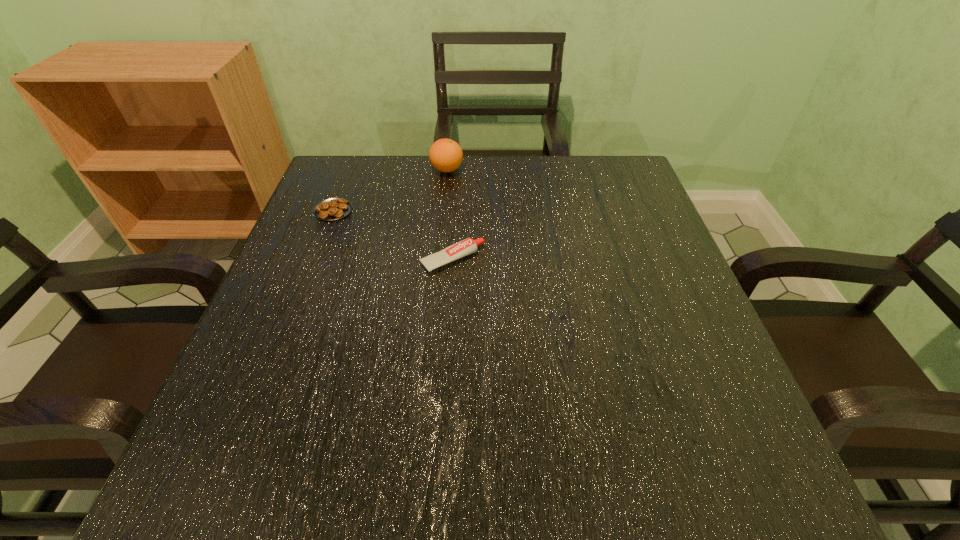
This screenshot has height=540, width=960. In order to click on free space between the second farthest object and the nearest object in this screenshot , I will do `click(393, 235)`.

Locate an element on the screen. The width and height of the screenshot is (960, 540). empty space between the shortest object and the toothpaste is located at coordinates (393, 235).

You are a GUI agent. You are given a task and a screenshot of the screen. Output one action in this format:
    pyautogui.click(x=<x>, y=<y>)
    Task: Click on the vacant space in between the tallest object and the second farthest object
    The width and height of the screenshot is (960, 540).
    Given the screenshot: What is the action you would take?
    pyautogui.click(x=391, y=190)

This screenshot has height=540, width=960. I want to click on vacant area that lies between the toothpaste and the orange, so click(449, 215).

Locate an element on the screen. free space between the pastry and the farthest object is located at coordinates pos(391,190).

The width and height of the screenshot is (960, 540). Find the location of `vacant region between the toothpaste and the orange`. vacant region between the toothpaste and the orange is located at coordinates (449, 215).

This screenshot has height=540, width=960. In order to click on vacant area that lies between the farthest object and the second farthest object in this screenshot , I will do `click(391, 190)`.

The image size is (960, 540). I want to click on vacant space that is in between the pastry and the farthest object, so click(391, 190).

Where is `vacant space in between the tallest object and the shortest object`? The image size is (960, 540). vacant space in between the tallest object and the shortest object is located at coordinates (391, 190).

Where is `empty space between the nearest object and the pastry`? empty space between the nearest object and the pastry is located at coordinates (393, 235).